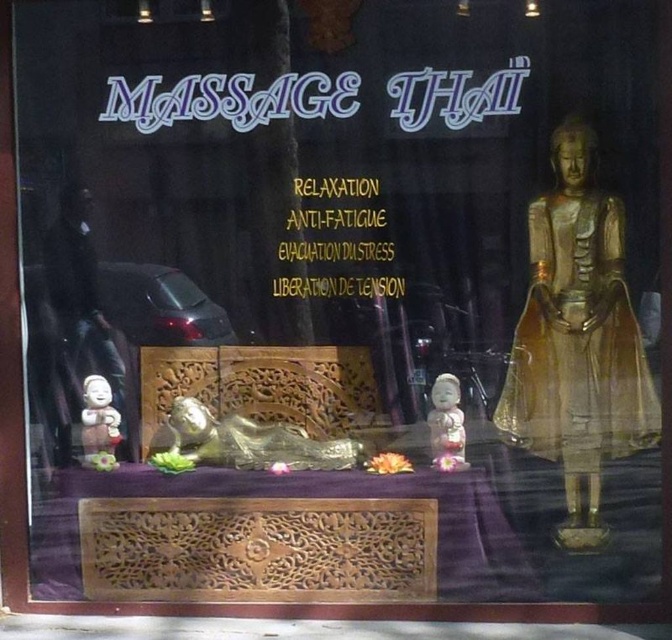
You are a customer entering the Thai massage establishment and see the display window with the white porcelain figurine at center and the white porcelain figurine at lower left. Which figurine do you think is taller?

The white porcelain figurine at center is much taller than the white porcelain figurine at lower left.

You are a customer standing in front of the Thai massage establishment display window. You notice the gold polished statue at right and the white porcelain figurine at lower left. Which object is located more to the right side of the display?

The gold polished statue at right is positioned on the right side of the white porcelain figurine at lower left, so it is located more to the right side of the display.